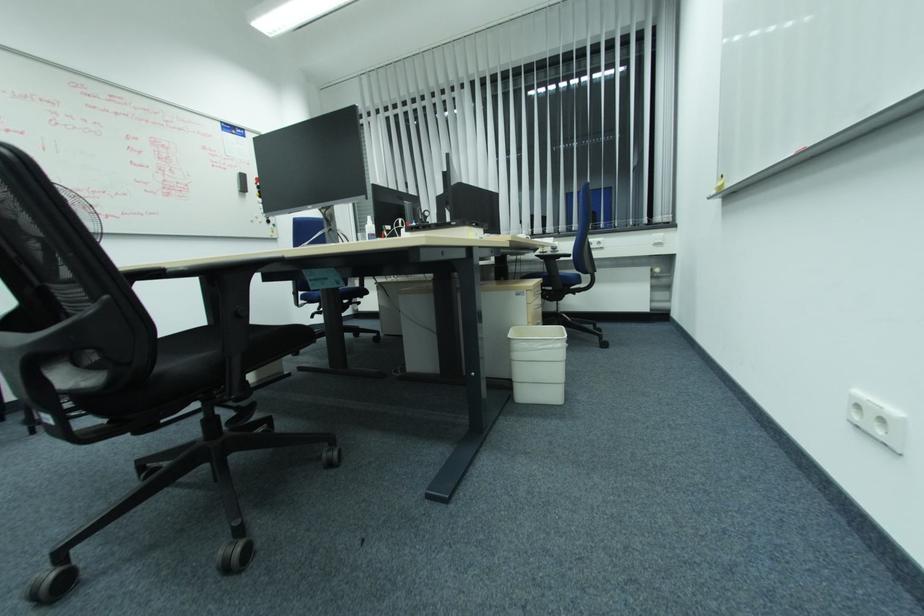
Locate an element on the screen. blue chair sitting surface is located at coordinates (566, 283).